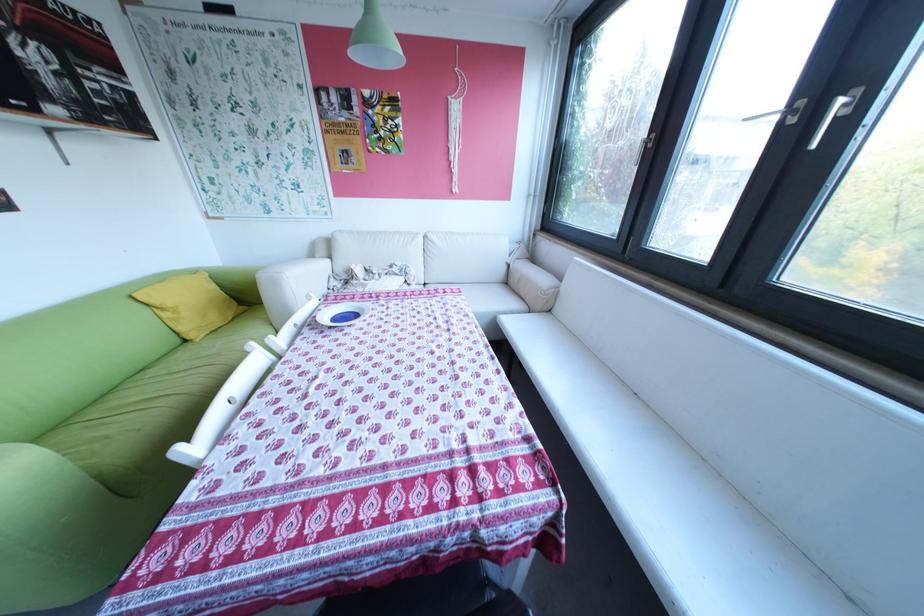
You are a GUI agent. You are given a task and a screenshot of the screen. Output one action in this format:
    pyautogui.click(x=<x>, y=<y>)
    Task: Click on the green sofa sitting surface
    The height and width of the screenshot is (616, 924).
    Given the screenshot: What is the action you would take?
    pyautogui.click(x=232, y=280)